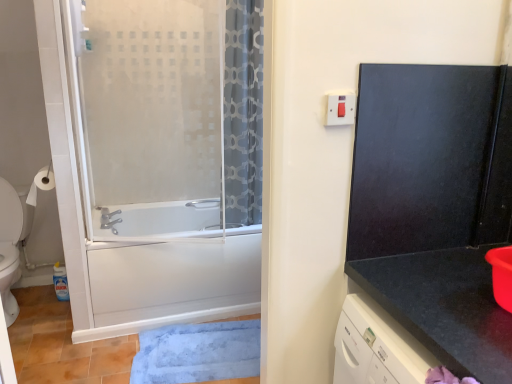
At what (x,y) coordinates should I click in order to perform the action: click on black matte screen door at upper right, positioned as the 1th screen door in right-to-left order. Please return your answer as a coordinate pair (x, y). Looking at the image, I should click on (430, 159).

Locate an element on the screen. This screenshot has width=512, height=384. blue plush bath mat at lower center is located at coordinates (198, 352).

The width and height of the screenshot is (512, 384). What do you see at coordinates (198, 352) in the screenshot?
I see `blue plush bath mat at lower center` at bounding box center [198, 352].

Where is `white glossy toilet at left`? Image resolution: width=512 pixels, height=384 pixels. white glossy toilet at left is located at coordinates (9, 247).

Which of these two, black matte screen door at upper right, acting as the second screen door starting from the left, or frosted glass screen door at left, arranged as the first screen door when viewed from the left, is thinner?

black matte screen door at upper right, acting as the second screen door starting from the left.

From a real-world perspective, is black matte screen door at upper right, positioned as the 1th screen door in right-to-left order, physically located above or below frosted glass screen door at left, arranged as the first screen door when viewed from the left?

From a real-world perspective, black matte screen door at upper right, positioned as the 1th screen door in right-to-left order, is physically above frosted glass screen door at left, arranged as the first screen door when viewed from the left.

Could you measure the distance between black matte screen door at upper right, positioned as the 1th screen door in right-to-left order, and frosted glass screen door at left, which is the 2th screen door in right-to-left order?

They are 1.37 meters apart.

Which is correct: black matte screen door at upper right, positioned as the 1th screen door in right-to-left order, is inside frosted glass screen door at left, which is the 2th screen door in right-to-left order, or outside of it?

The correct answer is: outside.

From the image's perspective, who appears lower, black matte screen door at upper right, positioned as the 1th screen door in right-to-left order, or white plastic switch at upper right?

black matte screen door at upper right, positioned as the 1th screen door in right-to-left order.

In terms of size, does black matte screen door at upper right, acting as the second screen door starting from the left, appear bigger or smaller than white plastic switch at upper right?

Clearly, black matte screen door at upper right, acting as the second screen door starting from the left, is larger in size than white plastic switch at upper right.

Locate an element on the screen. This screenshot has width=512, height=384. electric outlet located above the black matte screen door at upper right, acting as the second screen door starting from the left (from the image's perspective) is located at coordinates (340, 108).

Which object is further away from the camera, frosted glass screen door at left, arranged as the first screen door when viewed from the left, or white matte toilet paper at left?

Positioned behind is white matte toilet paper at left.

From a real-world perspective, which is physically below, frosted glass screen door at left, arranged as the first screen door when viewed from the left, or white matte toilet paper at left?

white matte toilet paper at left, from a real-world perspective.

Is frosted glass screen door at left, arranged as the first screen door when viewed from the left, positioned far away from white matte toilet paper at left?

frosted glass screen door at left, arranged as the first screen door when viewed from the left, is actually quite close to white matte toilet paper at left.

Between frosted glass screen door at left, which is the 2th screen door in right-to-left order, and white matte toilet paper at left, which one has less height?

white matte toilet paper at left.

How many degrees apart are the facing directions of white matte toilet paper at left and white plastic switch at upper right?

The angular difference between white matte toilet paper at left and white plastic switch at upper right is 87.2 degrees.

Can you confirm if white matte toilet paper at left is positioned to the left of white plastic switch at upper right?

Yes.

Is white matte toilet paper at left bigger or smaller than white plastic switch at upper right?

Clearly, white matte toilet paper at left is larger in size than white plastic switch at upper right.

Is white matte toilet paper at left turned away from white plastic switch at upper right?

No.

From a real-world perspective, relative to white plastic switch at upper right, is white glossy toilet at left vertically above or below?

From a real-world perspective, white glossy toilet at left is physically below white plastic switch at upper right.

In terms of width, does white glossy toilet at left look wider or thinner when compared to white plastic switch at upper right?

white glossy toilet at left is wider than white plastic switch at upper right.

Who is taller, white glossy toilet at left or white plastic switch at upper right?

With more height is white glossy toilet at left.

Based on their sizes in the image, would you say white glossy toilet at left is bigger or smaller than white plastic switch at upper right?

Clearly, white glossy toilet at left is larger in size than white plastic switch at upper right.

Looking at their sizes, would you say white matte toilet paper at left is wider or thinner than black granite countertop at right?

white matte toilet paper at left is thinner than black granite countertop at right.

Between white matte toilet paper at left and black granite countertop at right, which one has more height?

black granite countertop at right.

Could you tell me if white matte toilet paper at left is turned towards black granite countertop at right?

No.

Is white matte toilet paper at left far away from black granite countertop at right?

Yes, white matte toilet paper at left and black granite countertop at right are located far from each other.

In the image, is white matte toilet paper at left on the left side or the right side of frosted glass screen door at left, which is the 2th screen door in right-to-left order?

Clearly, white matte toilet paper at left is on the left of frosted glass screen door at left, which is the 2th screen door in right-to-left order, in the image.

From the image's perspective, is white matte toilet paper at left over frosted glass screen door at left, which is the 2th screen door in right-to-left order?

Correct, white matte toilet paper at left appears higher than frosted glass screen door at left, which is the 2th screen door in right-to-left order, in the image.

Where is `the 2nd screen door in front when counting from the white matte toilet paper at left`? Image resolution: width=512 pixels, height=384 pixels. the 2nd screen door in front when counting from the white matte toilet paper at left is located at coordinates (155, 168).

From the picture: Measure the distance from white matte toilet paper at left to frosted glass screen door at left, which is the 2th screen door in right-to-left order.

A distance of 28.83 inches exists between white matte toilet paper at left and frosted glass screen door at left, which is the 2th screen door in right-to-left order.

Image resolution: width=512 pixels, height=384 pixels. In order to click on screen door that is on the left side of black matte screen door at upper right, acting as the second screen door starting from the left in this screenshot , I will do click(155, 168).

Where is `electric outlet positioned vertically above the black matte screen door at upper right, positioned as the 1th screen door in right-to-left order (from a real-world perspective)`? The height and width of the screenshot is (384, 512). electric outlet positioned vertically above the black matte screen door at upper right, positioned as the 1th screen door in right-to-left order (from a real-world perspective) is located at coordinates (340, 108).

Considering their positions, is white matte toilet paper at left positioned further to frosted glass screen door at left, arranged as the first screen door when viewed from the left, than black matte screen door at upper right, acting as the second screen door starting from the left?

Based on the image, black matte screen door at upper right, acting as the second screen door starting from the left, appears to be further to frosted glass screen door at left, arranged as the first screen door when viewed from the left.

When comparing their distances from blue plush bath mat at lower center, does white glossy toilet at left or white plastic switch at upper right seem further?

white plastic switch at upper right is further to blue plush bath mat at lower center.

Estimate the real-world distances between objects in this image. Which object is further from white glossy toilet at left, frosted glass screen door at left, which is the 2th screen door in right-to-left order, or black granite countertop at right?

black granite countertop at right.

Looking at the image, which one is located further to white glossy toilet at left, white plastic switch at upper right or blue plush bath mat at lower center?

white plastic switch at upper right is further to white glossy toilet at left.

Looking at the image, which one is located closer to white plastic switch at upper right, white matte toilet paper at left or blue plush bath mat at lower center?

blue plush bath mat at lower center lies closer to white plastic switch at upper right than the other object.

Which object lies further to the anchor point black matte screen door at upper right, positioned as the 1th screen door in right-to-left order, blue plush bath mat at lower center or white glossy toilet at left?

white glossy toilet at left lies further to black matte screen door at upper right, positioned as the 1th screen door in right-to-left order, than the other object.

From the picture: Looking at the image, which one is located further to white plastic switch at upper right, black matte screen door at upper right, acting as the second screen door starting from the left, or blue plush bath mat at lower center?

blue plush bath mat at lower center is further to white plastic switch at upper right.

Considering their positions, is black granite countertop at right positioned further to white glossy toilet at left than frosted glass screen door at left, arranged as the first screen door when viewed from the left?

black granite countertop at right is further to white glossy toilet at left.

Where is `screen door between white matte toilet paper at left and black granite countertop at right from left to right`? screen door between white matte toilet paper at left and black granite countertop at right from left to right is located at coordinates (155, 168).

I want to click on electric outlet located between white glossy toilet at left and black matte screen door at upper right, positioned as the 1th screen door in right-to-left order, in the left-right direction, so click(x=340, y=108).

Where is `screen door situated between white matte toilet paper at left and black matte screen door at upper right, acting as the second screen door starting from the left, from left to right`? The width and height of the screenshot is (512, 384). screen door situated between white matte toilet paper at left and black matte screen door at upper right, acting as the second screen door starting from the left, from left to right is located at coordinates (155, 168).

This screenshot has height=384, width=512. Find the location of `bath mat between frosted glass screen door at left, arranged as the first screen door when viewed from the left, and white glossy toilet at left from front to back`. bath mat between frosted glass screen door at left, arranged as the first screen door when viewed from the left, and white glossy toilet at left from front to back is located at coordinates (198, 352).